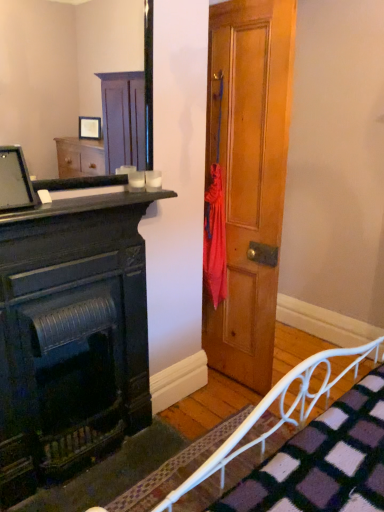
Where is `vacant area that is in front of wooden door at center`? The height and width of the screenshot is (512, 384). vacant area that is in front of wooden door at center is located at coordinates (215, 407).